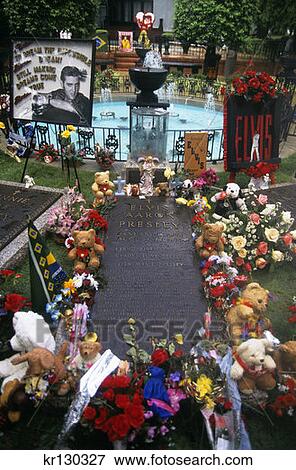
What are the coordinates of `teddy bears` in the screenshot? It's located at (252, 360), (253, 305), (204, 232), (87, 246), (103, 183), (47, 343), (87, 349).